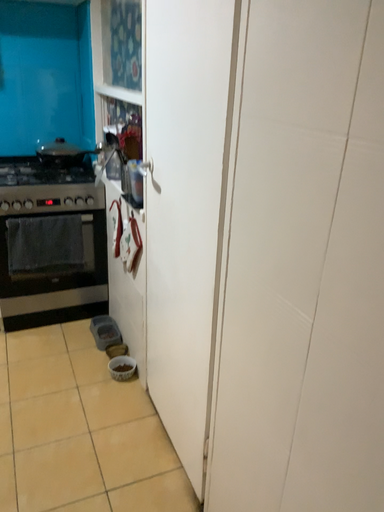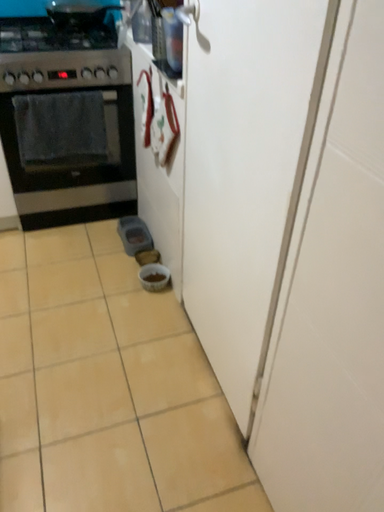
Question: How did the camera likely rotate when shooting the video?

Choices:
 (A) rotated downward
 (B) rotated upward

Answer: (A)